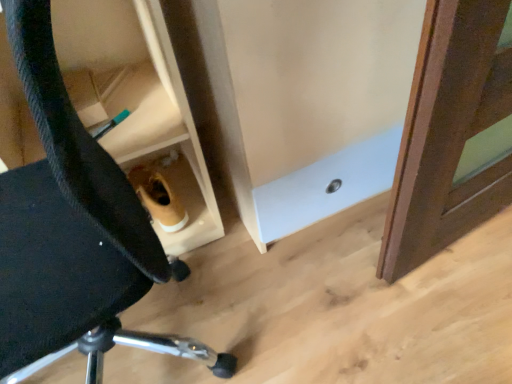
Question: From a real-world perspective, is black fabric chair at lower left located beneath wooden cabinet at lower center?

Choices:
 (A) yes
 (B) no

Answer: (B)

Question: From a real-world perspective, is black fabric chair at lower left located higher than wooden cabinet at lower center?

Choices:
 (A) yes
 (B) no

Answer: (A)

Question: Is black fabric chair at lower left wider than wooden cabinet at lower center?

Choices:
 (A) yes
 (B) no

Answer: (A)

Question: From the image's perspective, is black fabric chair at lower left under wooden cabinet at lower center?

Choices:
 (A) no
 (B) yes

Answer: (B)

Question: Can you confirm if black fabric chair at lower left is shorter than wooden cabinet at lower center?

Choices:
 (A) yes
 (B) no

Answer: (B)

Question: Would you say black fabric chair at lower left is outside wooden cabinet at lower center?

Choices:
 (A) no
 (B) yes

Answer: (B)

Question: From the image's perspective, would you say wooden cabinet at lower center is shown under black fabric chair at lower left?

Choices:
 (A) yes
 (B) no

Answer: (B)

Question: Is wooden cabinet at lower center oriented towards black fabric chair at lower left?

Choices:
 (A) no
 (B) yes

Answer: (A)

Question: From a real-world perspective, does wooden cabinet at lower center stand above black fabric chair at lower left?

Choices:
 (A) yes
 (B) no

Answer: (B)

Question: Is wooden cabinet at lower center at the left side of black fabric chair at lower left?

Choices:
 (A) no
 (B) yes

Answer: (A)

Question: Considering the relative sizes of wooden cabinet at lower center and black fabric chair at lower left in the image provided, is wooden cabinet at lower center shorter than black fabric chair at lower left?

Choices:
 (A) no
 (B) yes

Answer: (B)

Question: Considering the relative sizes of wooden cabinet at lower center and black fabric chair at lower left in the image provided, is wooden cabinet at lower center smaller than black fabric chair at lower left?

Choices:
 (A) yes
 (B) no

Answer: (A)

Question: In terms of width, does black fabric chair at lower left look wider or thinner when compared to wooden cabinet at lower center?

Choices:
 (A) wide
 (B) thin

Answer: (A)